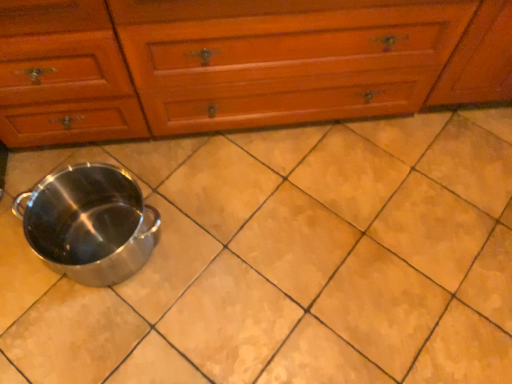
I want to click on free spot behind satin silver crock pot at lower left, so click(143, 168).